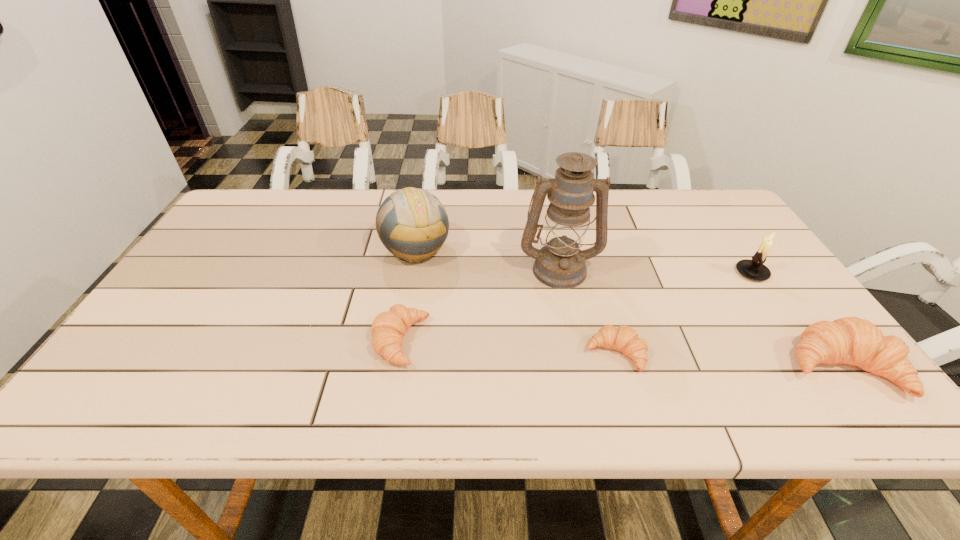
Identify the location of vacant spot to place a crescent roll on the left. This screenshot has height=540, width=960. (197, 329).